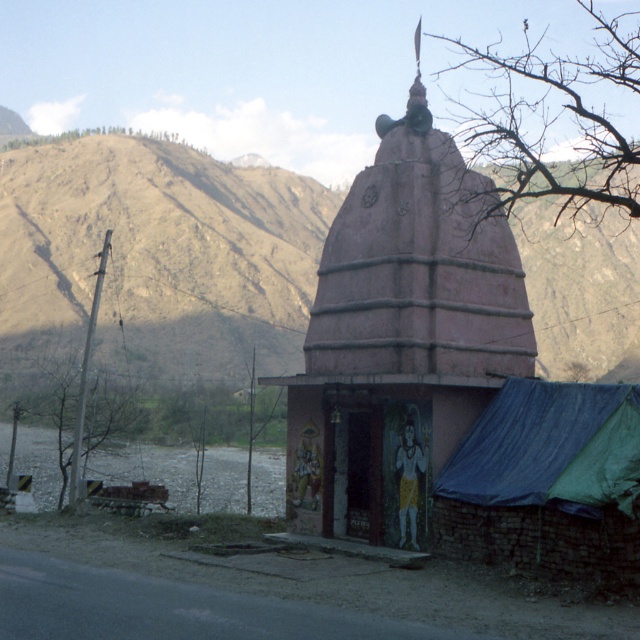
Question: From the image, what is the correct spatial relationship of blue tarpaulin tent at lower right in relation to gray gravel lake at lower left?

Choices:
 (A) right
 (B) left

Answer: (A)

Question: Which object appears farthest from the camera in this image?

Choices:
 (A) blue tarpaulin tent at lower right
 (B) brown rocky mountain at upper center

Answer: (B)

Question: Considering the relative positions of pink matte temple at center and blue tarpaulin tent at lower right in the image provided, where is pink matte temple at center located with respect to blue tarpaulin tent at lower right?

Choices:
 (A) right
 (B) left

Answer: (A)

Question: Which object is farther from the camera taking this photo?

Choices:
 (A) brown rocky mountain at upper center
 (B) gray gravel lake at lower left
 (C) pink matte temple at center

Answer: (B)

Question: Which point is farther from the camera taking this photo?

Choices:
 (A) (145, 468)
 (B) (385, 426)
 (C) (561, 548)

Answer: (A)

Question: Is pink matte temple at center to the left of gray gravel lake at lower left from the viewer's perspective?

Choices:
 (A) yes
 (B) no

Answer: (B)